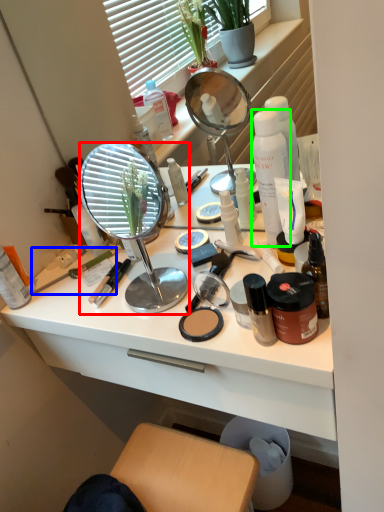
Question: Which object is the farthest from mirror (highlighted by a red box)? Choose among these: brush (highlighted by a blue box) or product (highlighted by a green box).

Choices:
 (A) brush
 (B) product

Answer: (B)